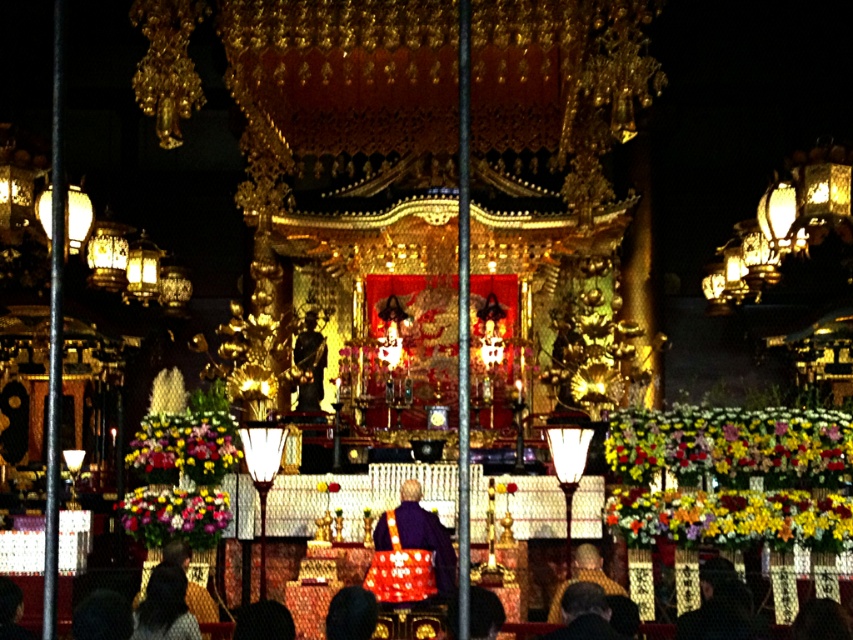
Question: Which point is closer to the camera?

Choices:
 (A) (589, 563)
 (B) (404, 500)

Answer: (B)

Question: Which point is farther from the camera taking this photo?

Choices:
 (A) (552, 621)
 (B) (374, 529)

Answer: (B)

Question: Is matte purple kimono at center further to the viewer compared to golden robe at center?

Choices:
 (A) yes
 (B) no

Answer: (A)

Question: In this image, where is matte purple kimono at center located relative to golden robe at center?

Choices:
 (A) right
 (B) left

Answer: (B)

Question: Which of the following is the farthest from the observer?

Choices:
 (A) golden robe at center
 (B) matte purple kimono at center

Answer: (B)

Question: Can you confirm if matte purple kimono at center is positioned to the left of golden robe at center?

Choices:
 (A) no
 (B) yes

Answer: (B)